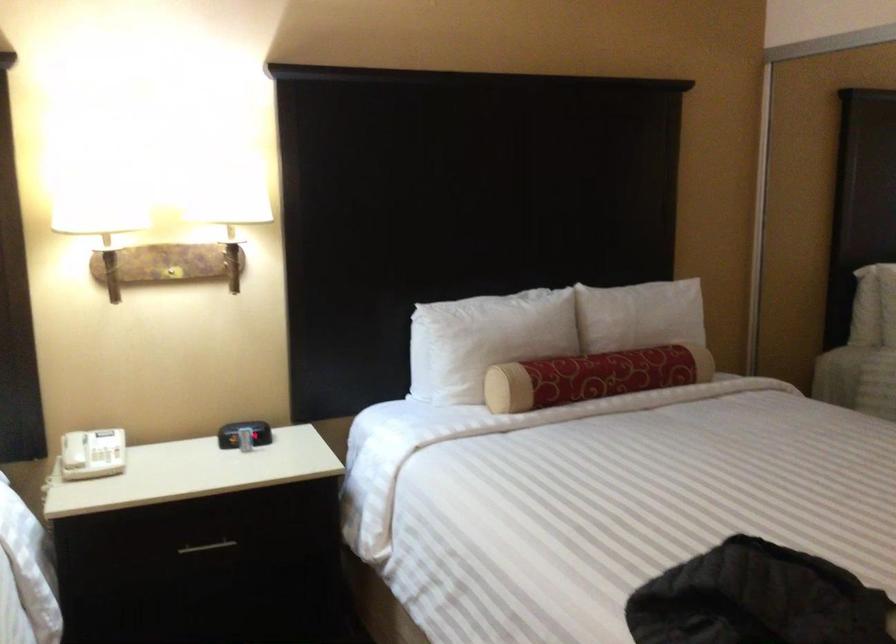
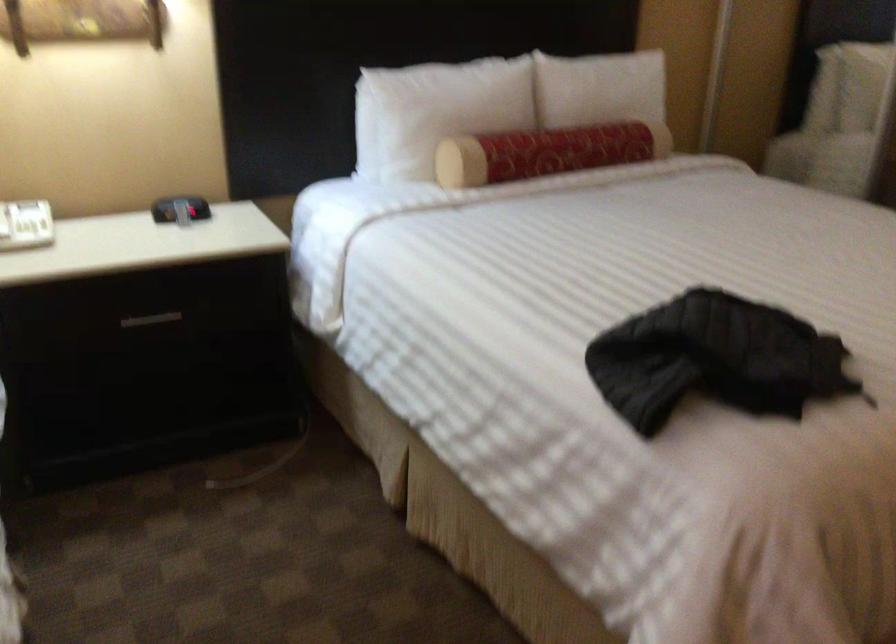
In the second image, find the point that corresponds to pixel 237 433 in the first image.

(179, 209)